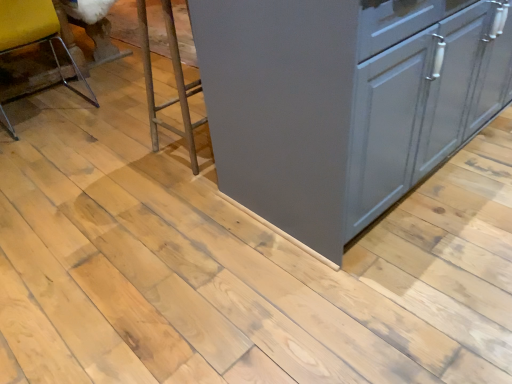
Locate an element on the screen. This screenshot has height=384, width=512. vacant space in front of clear plastic chair at left is located at coordinates (46, 147).